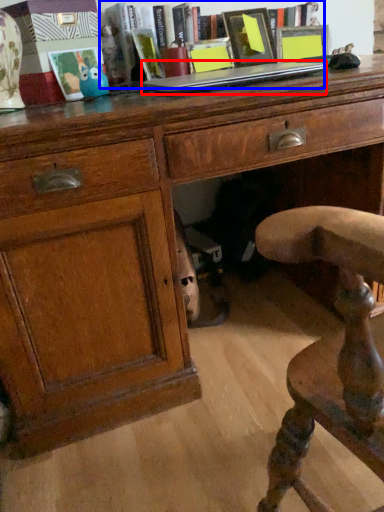
Question: Which of the following is the farthest to the observer, laptop (highlighted by a red box) or book (highlighted by a blue box)?

Choices:
 (A) laptop
 (B) book

Answer: (B)